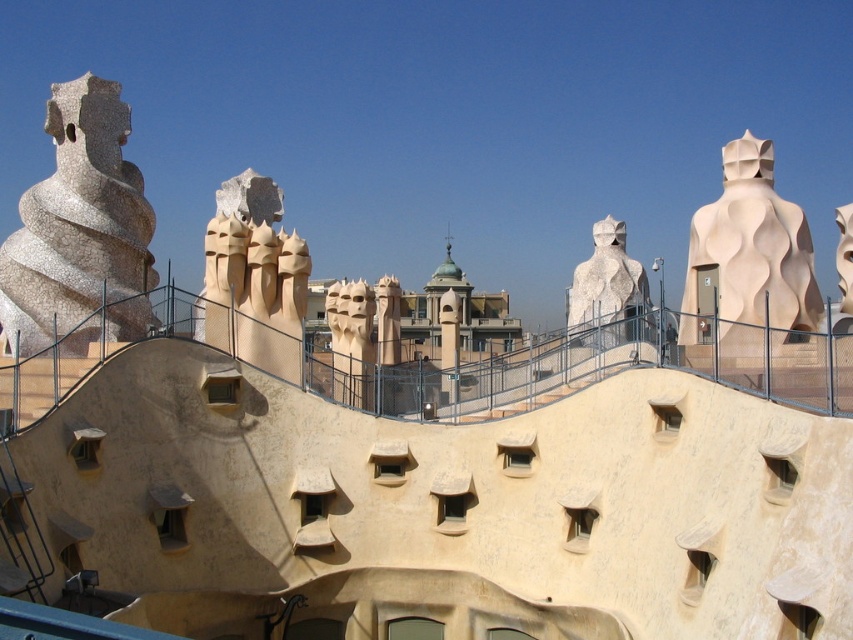
Between beige textured sculpture at right and white textured sculpture at center, which one is positioned lower?

beige textured sculpture at right

Is the position of beige textured sculpture at right less distant than that of white textured sculpture at center?

Yes, it is.

Where is `beige textured sculpture at right`? beige textured sculpture at right is located at coordinates (747, 260).

Image resolution: width=853 pixels, height=640 pixels. What are the coordinates of `beige textured sculpture at right` in the screenshot? It's located at (747, 260).

Looking at this image, which of these two, beige stone face at center or smooth beige sculpture at upper right, stands taller?

Standing taller between the two is smooth beige sculpture at upper right.

Identify the location of beige stone face at center. The image size is (853, 640). (351, 340).

Is beige textured sculpture at right below beige stone face at center?

No, beige textured sculpture at right is not below beige stone face at center.

What do you see at coordinates (747, 260) in the screenshot? The width and height of the screenshot is (853, 640). I see `beige textured sculpture at right` at bounding box center [747, 260].

At what (x,y) coordinates should I click in order to perform the action: click on beige textured sculpture at right. Please return your answer as a coordinate pair (x, y). This screenshot has width=853, height=640. Looking at the image, I should click on (747, 260).